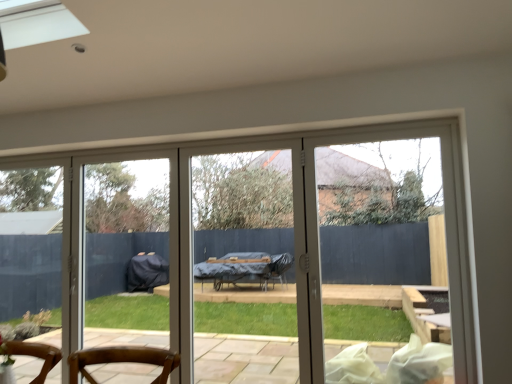
Question: In terms of width, does clear glass screen door at center look wider or thinner when compared to white glossy door at center?

Choices:
 (A) thin
 (B) wide

Answer: (B)

Question: Is clear glass screen door at center inside the boundaries of white glossy door at center, or outside?

Choices:
 (A) inside
 (B) outside

Answer: (B)

Question: Based on their positions, is clear glass screen door at center located to the left or right of white glossy door at center?

Choices:
 (A) right
 (B) left

Answer: (B)

Question: Considering the positions of white glossy door at center and clear glass screen door at center in the image, is white glossy door at center taller or shorter than clear glass screen door at center?

Choices:
 (A) tall
 (B) short

Answer: (A)

Question: Considering the positions of white glossy door at center and clear glass screen door at center in the image, is white glossy door at center wider or thinner than clear glass screen door at center?

Choices:
 (A) thin
 (B) wide

Answer: (A)

Question: Looking at the image, does white glossy door at center seem bigger or smaller compared to clear glass screen door at center?

Choices:
 (A) small
 (B) big

Answer: (B)

Question: Is point (399, 276) closer or farther from the camera than point (178, 218)?

Choices:
 (A) closer
 (B) farther

Answer: (A)